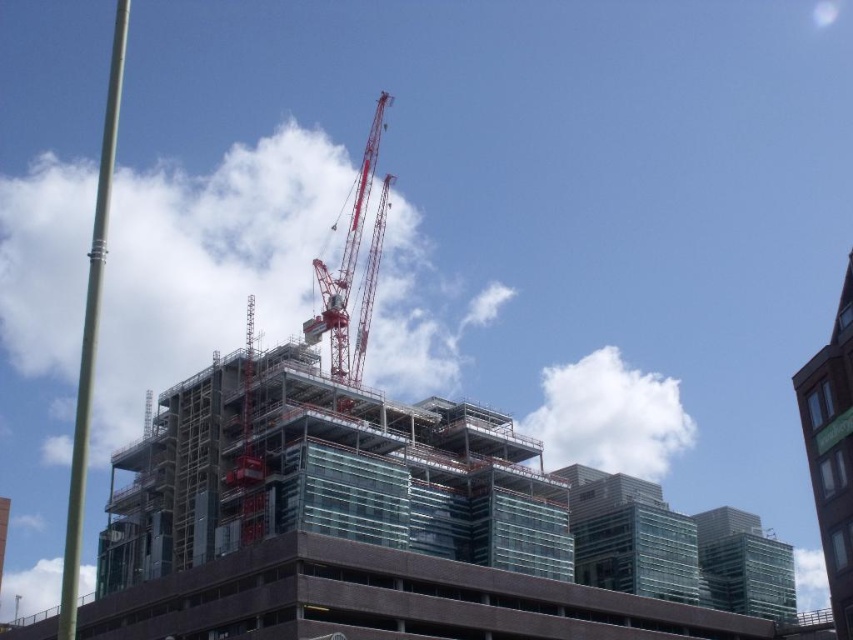
Which is above, brown brick building at upper right or red metallic crane at center?

Positioned higher is red metallic crane at center.

Can you confirm if brown brick building at upper right is taller than red metallic crane at center?

No.

Looking at this image, who is more forward, (x=802, y=396) or (x=378, y=237)?

Point (x=802, y=396)

Image resolution: width=853 pixels, height=640 pixels. Find the location of `brown brick building at upper right`. brown brick building at upper right is located at coordinates (831, 451).